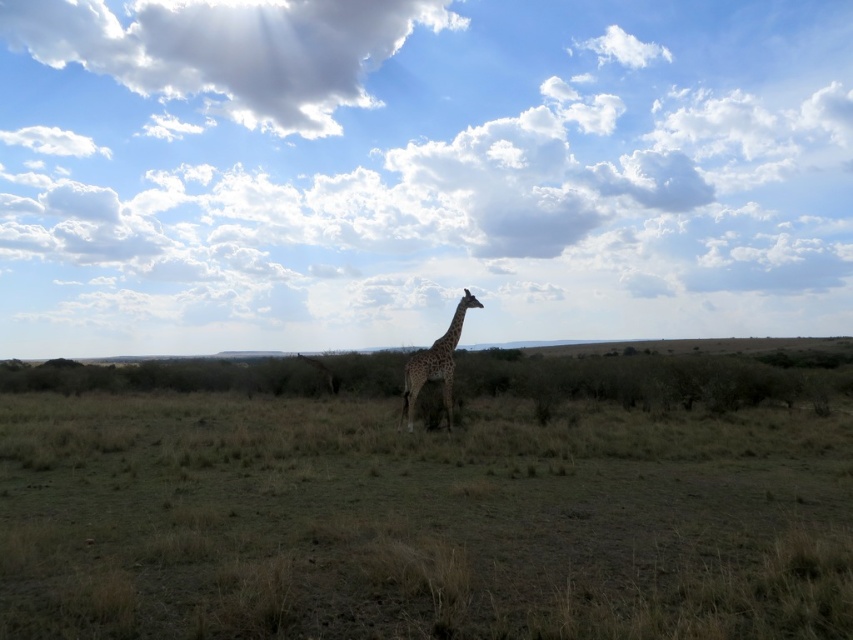
You are an airplane pilot flying over a savanna. You notice a cloudy sky at upper center and a giraffe at center. Which object is closer to your airplane?

The cloudy sky at upper center is closer to your airplane because it is further to the viewer than the giraffe at center.

You are an airplane pilot flying over a savanna. You notice a white fluffy cloud at upper left and a giraffe at center. Which object is higher in the sky?

The white fluffy cloud at upper left is higher in the sky than the giraffe at center.

You are an airplane pilot flying over the savanna and notice the white fluffy cloud at upper left and the giraffe at center. Which object is positioned more to the left?

The white fluffy cloud at upper left is positioned more to the left than the giraffe at center.